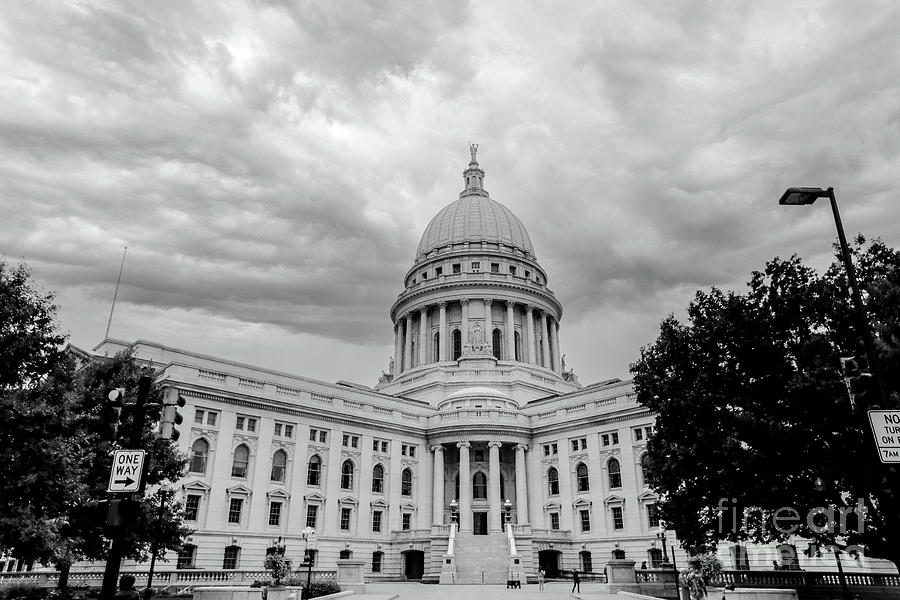
Identify the location of staircase leading up to entrance. Image resolution: width=900 pixels, height=600 pixels. (479, 558), (477, 567), (482, 533).